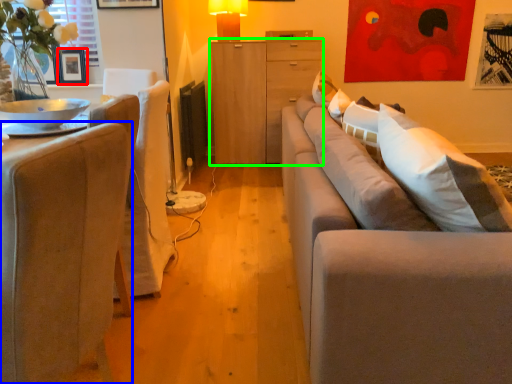
Question: Estimate the real-world distances between objects in this image. Which object is closer to picture frame (highlighted by a red box), chair (highlighted by a blue box) or cabinetry (highlighted by a green box)?

Choices:
 (A) chair
 (B) cabinetry

Answer: (B)